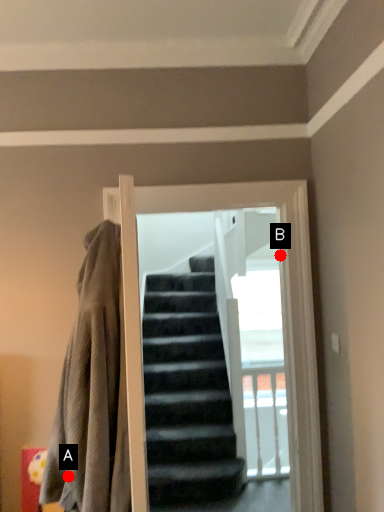
Question: Two points are circled on the image, labeled by A and B beside each circle. Which point is farther from the camera taking this photo?

Choices:
 (A) A is further
 (B) B is further

Answer: (B)